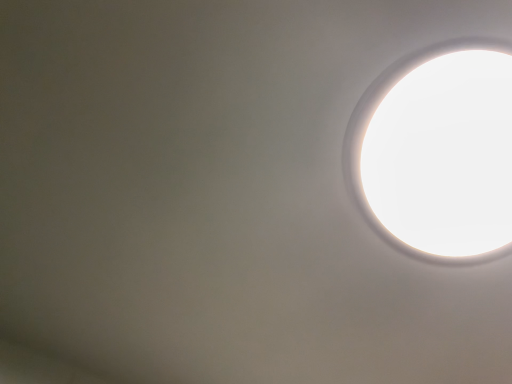
Measure the distance between white glossy lampshade at upper right and camera.

They are 52.14 centimeters apart.

Identify the location of white glossy lampshade at upper right. (437, 153).

What do you see at coordinates (437, 153) in the screenshot? The width and height of the screenshot is (512, 384). I see `white glossy lampshade at upper right` at bounding box center [437, 153].

Find the location of a particular element. The image size is (512, 384). white glossy lampshade at upper right is located at coordinates (437, 153).